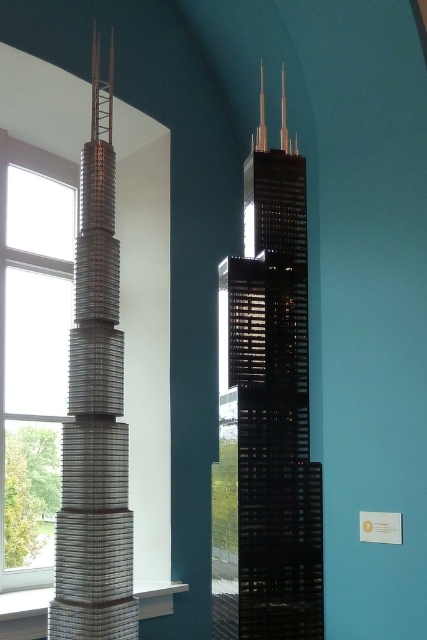
Question: Can you confirm if black glass tower at center is positioned below metallic silver tower at left?

Choices:
 (A) no
 (B) yes

Answer: (B)

Question: Is black glass tower at center behind metallic silver tower at left?

Choices:
 (A) no
 (B) yes

Answer: (A)

Question: Which point is closer to the camera taking this photo?

Choices:
 (A) 263,596
 (B) 105,464

Answer: (A)

Question: Can you confirm if black glass tower at center is smaller than metallic silver tower at left?

Choices:
 (A) no
 (B) yes

Answer: (B)